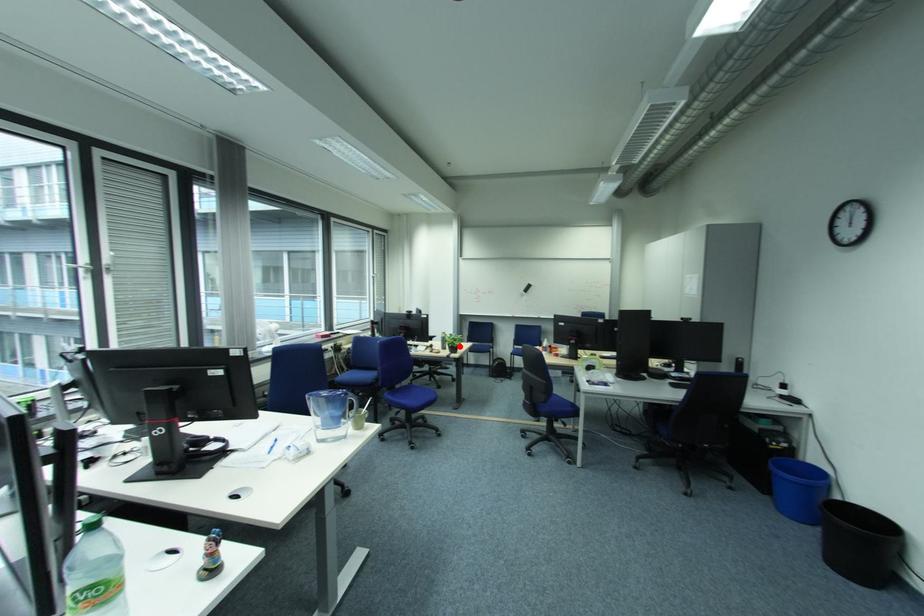
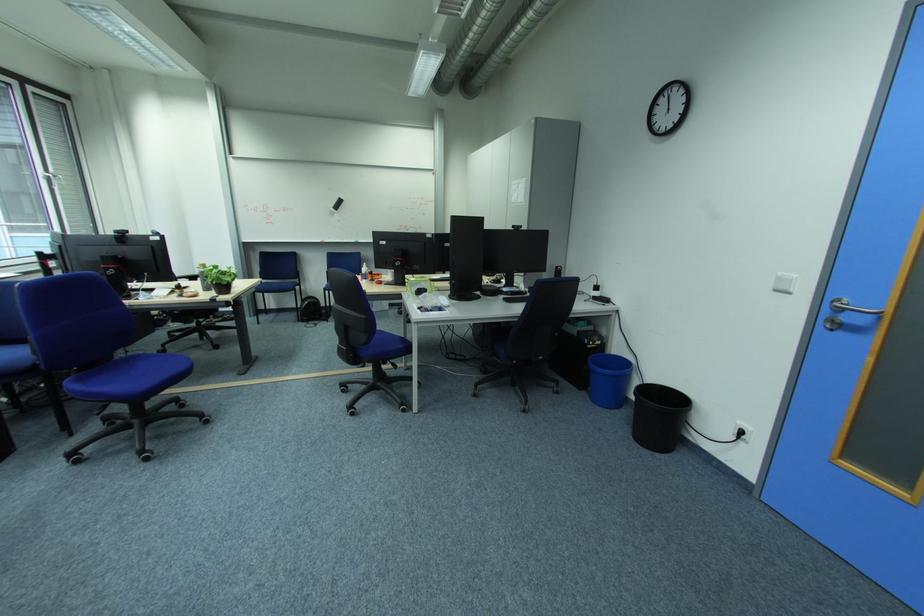
In the second image, find the point that corresponds to the highlighted location in the first image.

(224, 284)